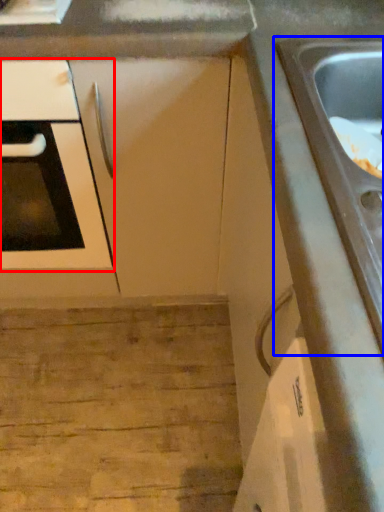
Question: Which of the following is the closest to the observer, oven (highlighted by a red box) or sink (highlighted by a blue box)?

Choices:
 (A) oven
 (B) sink

Answer: (B)